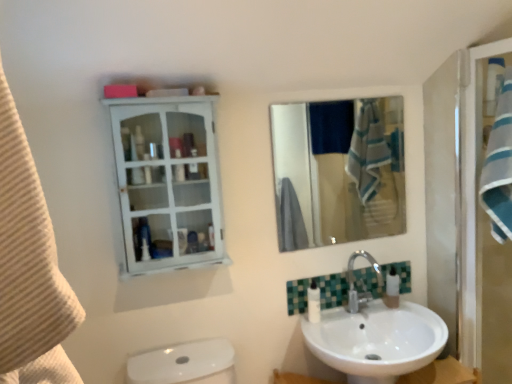
You are a GUI agent. You are given a task and a screenshot of the screen. Output one action in this format:
    pyautogui.click(x=<x>, y=<y>)
    Task: Click on the free space in front of white plastic soap dispenser at lower right
    The width and height of the screenshot is (512, 384).
    Given the screenshot: What is the action you would take?
    pyautogui.click(x=413, y=311)